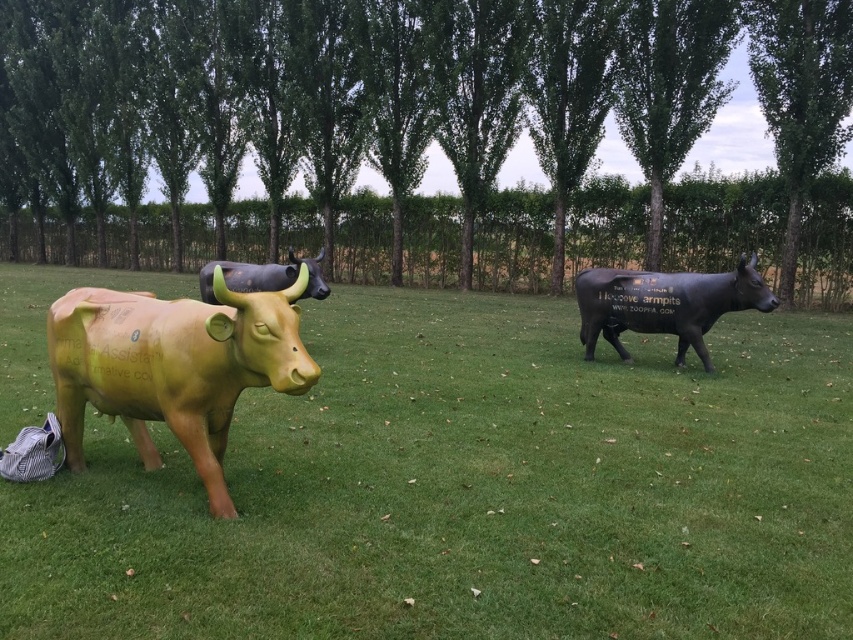
Is green grass at center bigger than matte black bull at right?

Correct, green grass at center is larger in size than matte black bull at right.

Is green grass at center below matte black bull at right?

Correct, green grass at center is located below matte black bull at right.

This screenshot has height=640, width=853. In order to click on green grass at center in this screenshot , I will do `click(469, 490)`.

Between point (51, 488) and point (262, 273), which one is positioned in front?

Point (51, 488) is more forward.

Does green grass at center lie behind matte black bull at center?

That is False.

The image size is (853, 640). Describe the element at coordinates (469, 490) in the screenshot. I see `green grass at center` at that location.

Image resolution: width=853 pixels, height=640 pixels. I want to click on green grass at center, so click(469, 490).

Who is lower down, matte yellow bull at left or matte black bull at right?

matte yellow bull at left is below.

Who is shorter, matte yellow bull at left or matte black bull at right?

With less height is matte yellow bull at left.

What do you see at coordinates (173, 365) in the screenshot? I see `matte yellow bull at left` at bounding box center [173, 365].

Where is `matte yellow bull at left`? Image resolution: width=853 pixels, height=640 pixels. matte yellow bull at left is located at coordinates (173, 365).